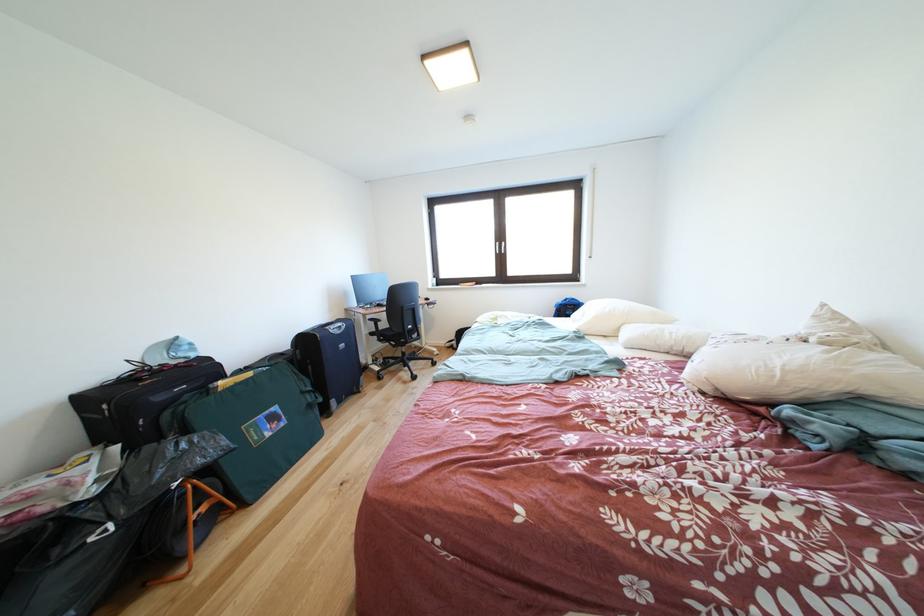
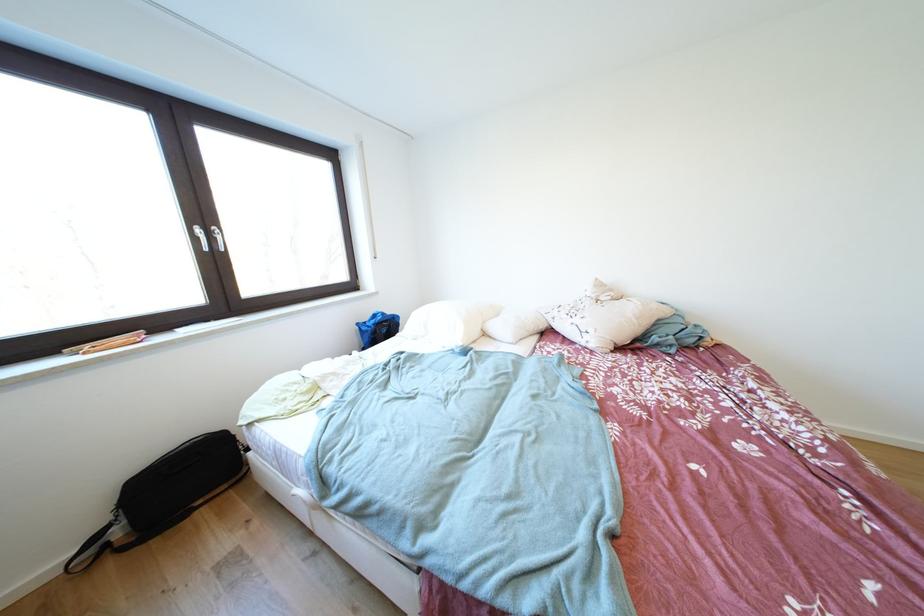
Find the pixel in the second image that matches the point at 833,310 in the first image.

(604, 284)